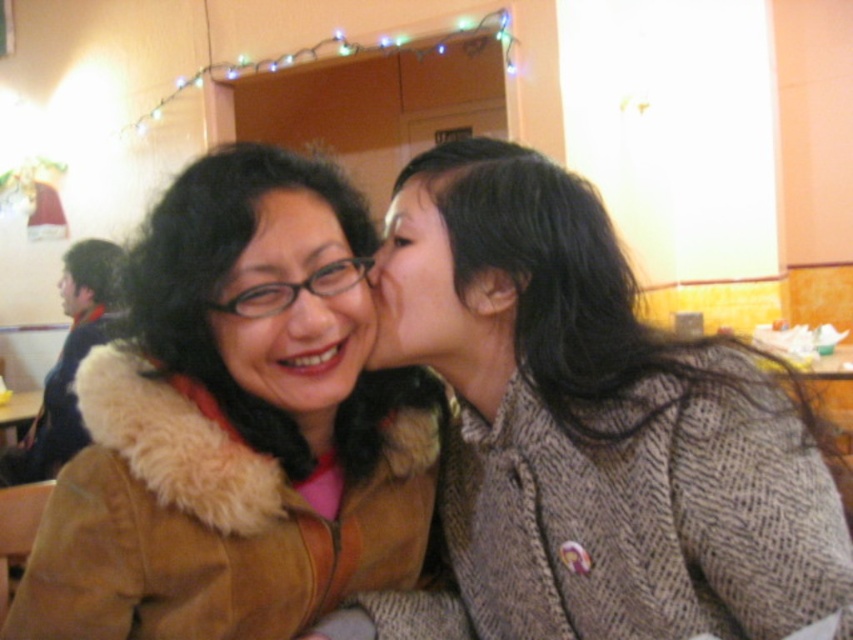
You are a tailor who needs to determine which coat requires more fabric for alterations. Based on the image, which coat between the brown textured coat at center and the matte brown coat at center should you prioritize?

The brown textured coat at center is bigger than the matte brown coat at center, so it requires more fabric for alterations and should be prioritized.

You are a photographer setting up for a portrait. You have a camera with a 50mm lens that can focus on objects up to 1 meter apart. You need to ensure that both the brown suede jacket at upper left and the matte black hair at center are in focus. Given their sizes, will both fit within the camera lens range?

The brown suede jacket at upper left is bigger than the matte black hair at center. Since the camera lens can focus on objects up to 1 meter apart, and the jacket is larger, it depends on their actual sizes. However, the description only states size comparison, not distance. Without knowing their distance from each other or the lens, we cannot confirm if they fit within the 1 meter range.

You are a tailor who needs to determine which coat requires a wider table to lay out for alterations. Based on the image, which coat between the brown textured coat at center and the matte brown coat at center needs a larger table surface?

The brown textured coat at center requires a larger table surface because its width is greater than that of the matte brown coat at center.